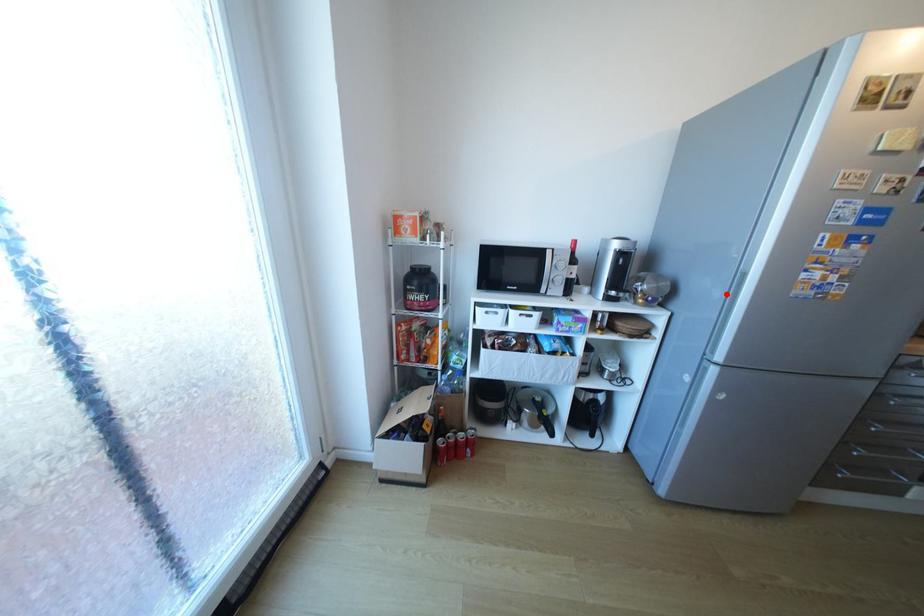
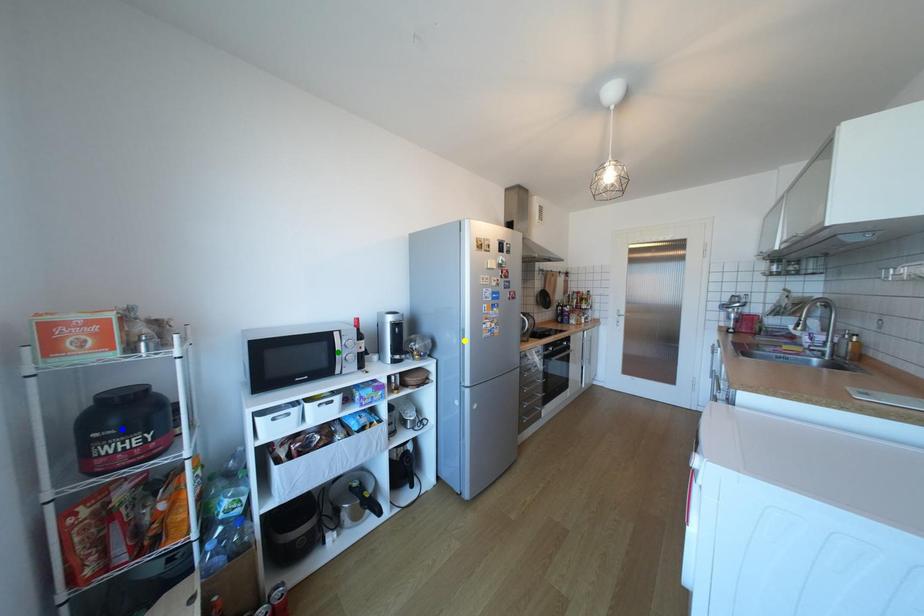
Question: I am providing you with two images of the same scene from different viewpoints. A red point is marked on the first image. You are given multiple points on the second image. Which mark in image 2 goes with the point in image 1?

Choices:
 (A) blue point
 (B) green point
 (C) yellow point

Answer: (C)